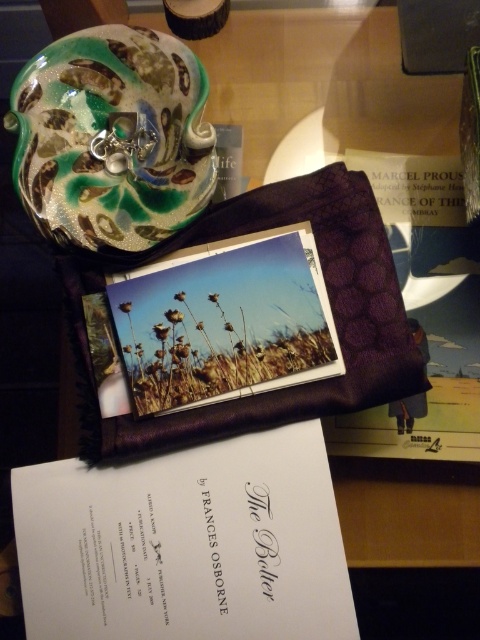
What do you see at coordinates (111, 138) in the screenshot? I see `shiny ceramic plate at upper left` at bounding box center [111, 138].

Between point (60, 80) and point (228, 209), which one is positioned in front?

Positioned in front is point (60, 80).

Locate an element on the screen. The image size is (480, 640). shiny ceramic plate at upper left is located at coordinates (111, 138).